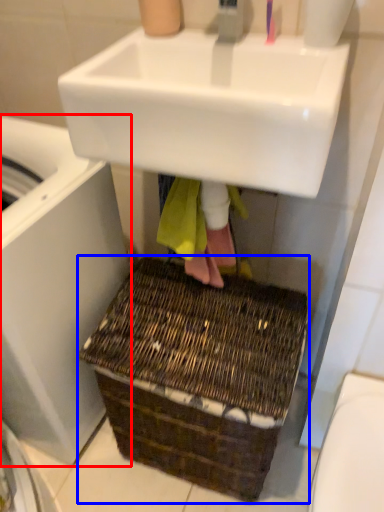
Question: Which object is further to the camera taking this photo, washing machine (highlighted by a red box) or basket (highlighted by a blue box)?

Choices:
 (A) washing machine
 (B) basket

Answer: (B)